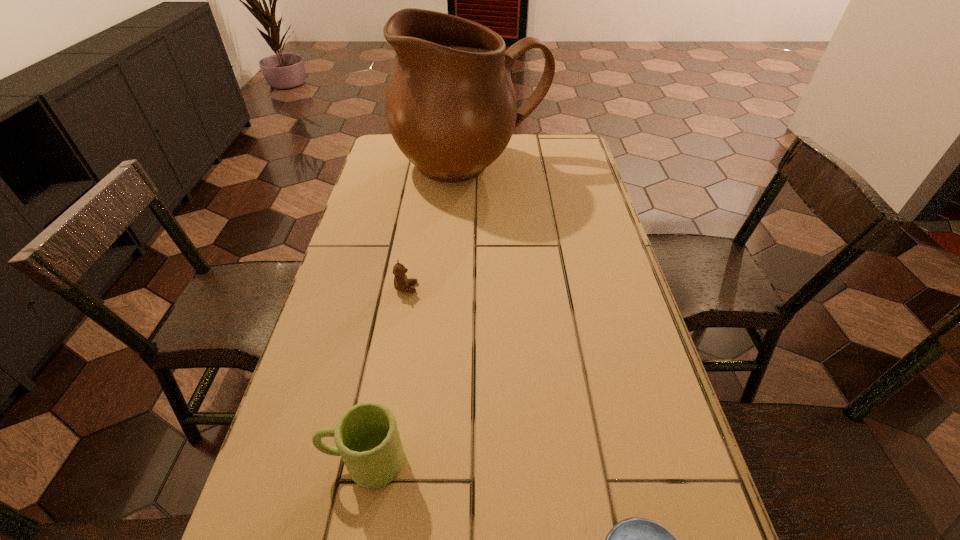
Identify the location of cream pitcher situated at the left edge. (451, 107).

In order to click on mug that is at the left edge in this screenshot , I will do `click(367, 438)`.

Where is `object at the right edge`? The width and height of the screenshot is (960, 540). object at the right edge is located at coordinates (451, 107).

This screenshot has height=540, width=960. In order to click on object at the far left corner in this screenshot , I will do `click(451, 107)`.

Identify the location of object that is at the far right corner. (451, 107).

In the image, there is a desktop. Identify the location of vacant space at the left edge. (365, 333).

The height and width of the screenshot is (540, 960). Identify the location of free location at the right edge. point(586,296).

I want to click on vacant point located between the second shortest object and the mug, so coord(385,374).

Where is `vacant space in between the farthest object and the mug`? This screenshot has width=960, height=540. vacant space in between the farthest object and the mug is located at coordinates (418, 314).

The width and height of the screenshot is (960, 540). Identify the location of vacant region between the third tallest object and the farthest object. (439, 227).